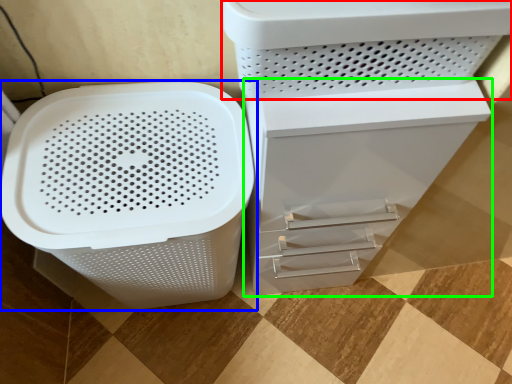
Question: Which object is positioned farthest from appliance (highlighted by a red box)? Select from waste container (highlighted by a blue box) and file cabinet (highlighted by a green box).

Choices:
 (A) waste container
 (B) file cabinet

Answer: (A)